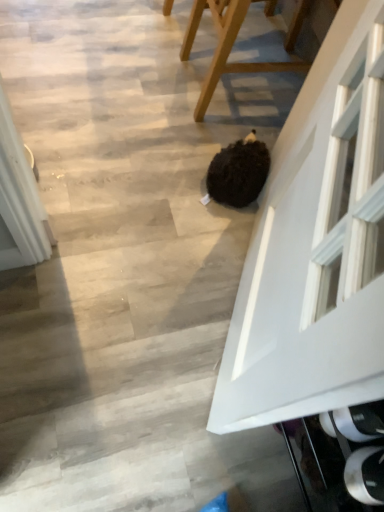
The height and width of the screenshot is (512, 384). Identify the location of vacant space underneath wooden chair at center (from a real-world perspective). (239, 89).